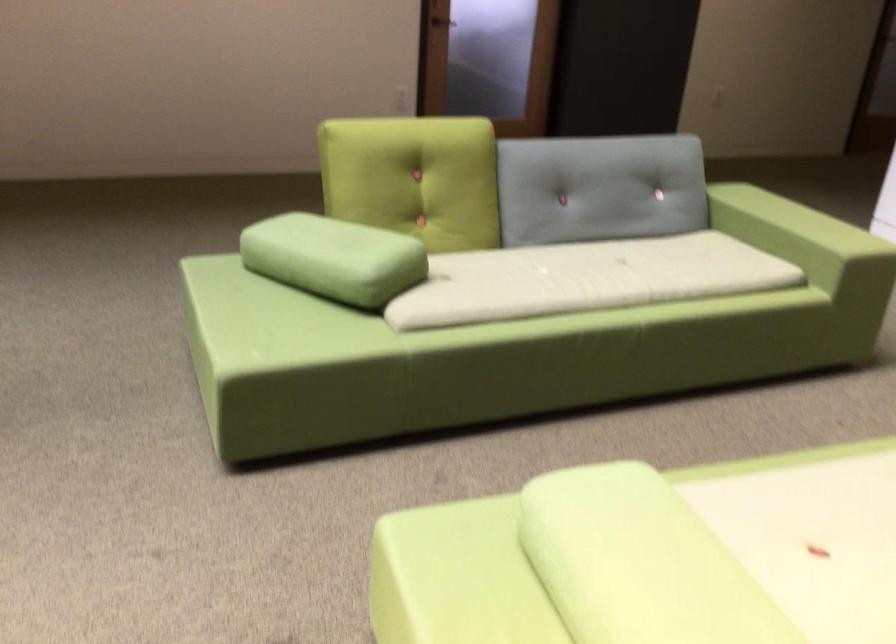
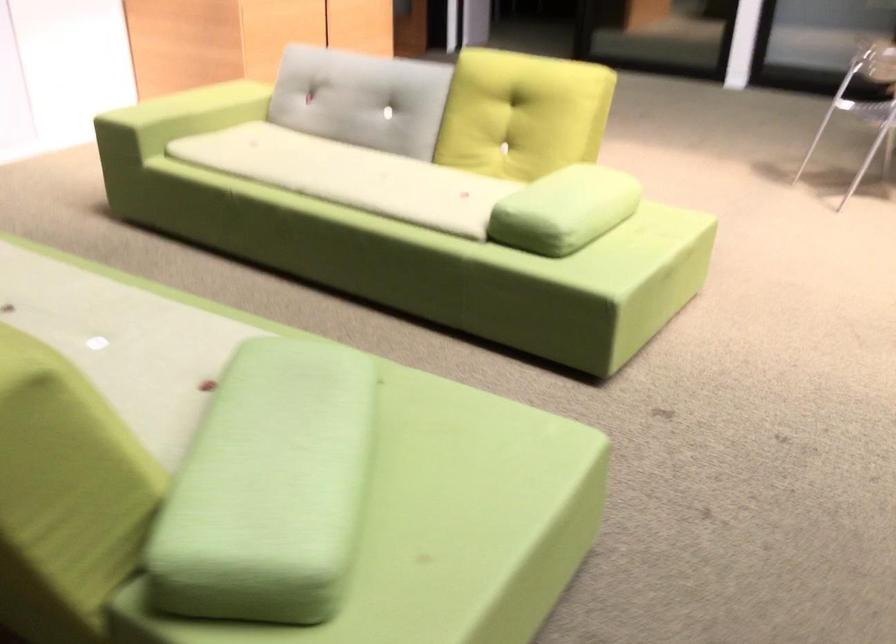
Find the pixel in the second image that matches point 615,261 in the first image.

(66, 290)